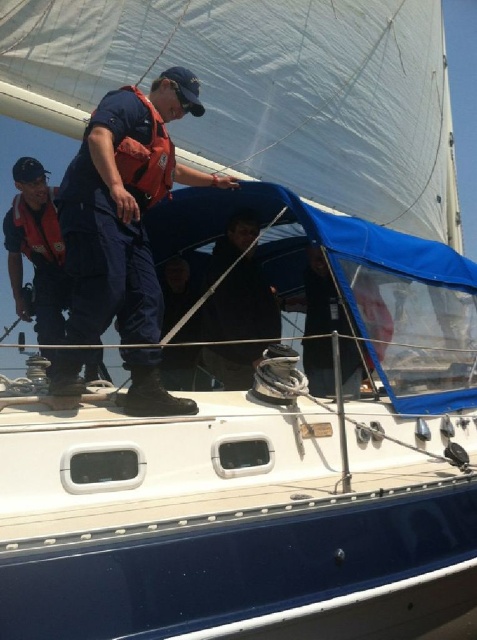
Does black matte jacket at center have a larger size compared to orange life jacket at left?

Indeed, black matte jacket at center has a larger size compared to orange life jacket at left.

Does black matte jacket at center lie behind orange life jacket at left?

Yes, it is.

Is point (278, 337) closer to viewer compared to point (52, 248)?

No, (278, 337) is behind (52, 248).

Where is `black matte jacket at center`? This screenshot has width=477, height=640. black matte jacket at center is located at coordinates (241, 305).

Is blue cotton sailor at center wider than black matte jacket at center?

Yes.

Which of these two, blue cotton sailor at center or black matte jacket at center, stands taller?

Standing taller between the two is blue cotton sailor at center.

Locate an element on the screen. blue cotton sailor at center is located at coordinates (123, 205).

Image resolution: width=477 pixels, height=640 pixels. What are the coordinates of `blue cotton sailor at center` in the screenshot? It's located at (123, 205).

Does blue cotton sailor at center appear on the right side of orange life jacket at left?

Yes, blue cotton sailor at center is to the right of orange life jacket at left.

Which of these two, blue cotton sailor at center or orange life jacket at left, stands taller?

With more height is blue cotton sailor at center.

Is point (118, 234) farther from viewer compared to point (39, 228)?

No, it is not.

In order to click on blue cotton sailor at center in this screenshot , I will do `click(123, 205)`.